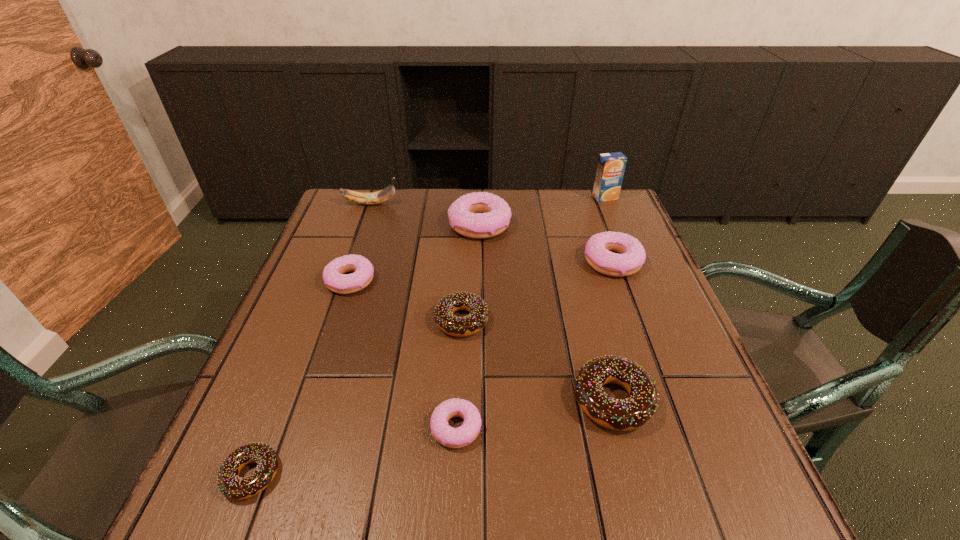
At what (x,y) coordinates should I click in order to perform the action: click on blank region between the rightmost purple doughnut and the orange_juice. Please return your answer as a coordinate pair (x, y). This screenshot has width=960, height=540. Looking at the image, I should click on (609, 229).

Where is `object that stands as the second closest to the smallest chocolate doughnut`? Image resolution: width=960 pixels, height=540 pixels. object that stands as the second closest to the smallest chocolate doughnut is located at coordinates (455, 326).

Point out which object is positioned as the eighth nearest to the second tallest object. Please provide its 2D coordinates. Your answer should be formatted as a tuple, i.e. [(x, y)], where the tuple contains the x and y coordinates of a point satisfying the conditions above.

[(232, 486)]

Locate which doughnut ranks sixth in proximity to the second biggest purple doughnut. Please provide its 2D coordinates. Your answer should be formatted as a tuple, i.e. [(x, y)], where the tuple contains the x and y coordinates of a point satisfying the conditions above.

[(232, 486)]

Where is `the third closest doughnut to the biggest purple doughnut`? Image resolution: width=960 pixels, height=540 pixels. the third closest doughnut to the biggest purple doughnut is located at coordinates [x=455, y=326].

Select which purple doughnut appears as the third closest to the orange_juice. Please provide its 2D coordinates. Your answer should be formatted as a tuple, i.e. [(x, y)], where the tuple contains the x and y coordinates of a point satisfying the conditions above.

[(334, 276)]

You are a GUI agent. You are given a task and a screenshot of the screen. Output one action in this format:
    pyautogui.click(x=<x>, y=<y>)
    Task: Click on the purple doughnut that can be found as the second closest to the tallest object
    
    Given the screenshot: What is the action you would take?
    pyautogui.click(x=479, y=215)

Choose which chocolate doughnut is the third nearest neighbor to the yellow banana. Please provide its 2D coordinates. Your answer should be formatted as a tuple, i.e. [(x, y)], where the tuple contains the x and y coordinates of a point satisfying the conditions above.

[(232, 486)]

Find the location of `the closest chocolate doughnut to the second farthest chocolate doughnut`. the closest chocolate doughnut to the second farthest chocolate doughnut is located at coordinates (455, 326).

Find the location of a particular element. vacant space that satisfies the following two spatial constraints: 1. on the back side of the biggest chocolate doughnut; 2. on the peel of the second tallest object is located at coordinates (562, 204).